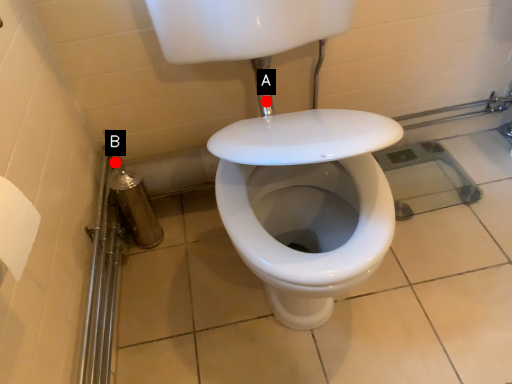
Question: Two points are circled on the image, labeled by A and B beside each circle. Which of the following is the farthest from the observer?

Choices:
 (A) A is further
 (B) B is further

Answer: (B)